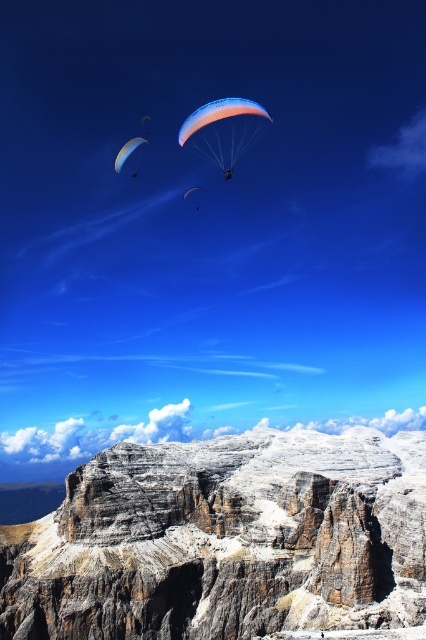
Looking at this image, can you confirm if rocky cliff at lower center is positioned to the right of matte orange parachute at upper center?

Yes, rocky cliff at lower center is to the right of matte orange parachute at upper center.

Does rocky cliff at lower center have a greater height compared to matte orange parachute at upper center?

Yes.

Identify the location of rocky cliff at lower center. (227, 540).

Who is positioned more to the right, rocky cliff at lower center or translucent orange parachute at center?

Positioned to the right is rocky cliff at lower center.

Is rocky cliff at lower center above translucent orange parachute at center?

No, rocky cliff at lower center is not above translucent orange parachute at center.

This screenshot has height=640, width=426. Find the location of `rocky cliff at lower center`. rocky cliff at lower center is located at coordinates (227, 540).

The image size is (426, 640). What do you see at coordinates (227, 540) in the screenshot? I see `rocky cliff at lower center` at bounding box center [227, 540].

Is rocky cliff at lower center wider than matte blue parachute at upper left?

Yes.

Where is `rocky cliff at lower center`? Image resolution: width=426 pixels, height=640 pixels. rocky cliff at lower center is located at coordinates (227, 540).